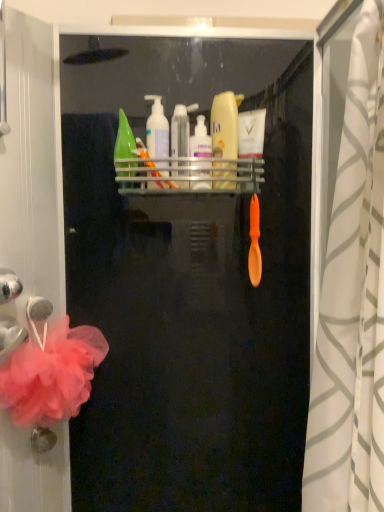
Question: Looking at their shapes, would you say transparent plastic screen door at upper center is wider or thinner than metallic silver shelf at upper center?

Choices:
 (A) thin
 (B) wide

Answer: (B)

Question: Visually, is transparent plastic screen door at upper center positioned to the left or to the right of metallic silver shelf at upper center?

Choices:
 (A) right
 (B) left

Answer: (B)

Question: Which is nearer to the white textured shower curtain at right?

Choices:
 (A) metallic silver shelf at upper center
 (B) yellow matte bottle at upper center, the second cleaning product from the left
 (C) transparent plastic tube at center, arranged as the 3th toiletry when viewed from the right
 (D) pink tulle bath towel at left
 (E) transparent plastic screen door at upper center

Answer: (A)

Question: Which object is the closest to the yellow matte bottle at upper center, the 1th cleaning product in the right-to-left sequence?

Choices:
 (A) white matte cream at upper center, the fourth toiletry when ordered from left to right
 (B) white plastic pump bottle at upper center, marked as the second toiletry in a right-to-left arrangement
 (C) transparent plastic screen door at upper center
 (D) metallic silver shelf at upper center
 (E) transparent plastic tube at center, positioned as the second toiletry in left-to-right order

Answer: (A)